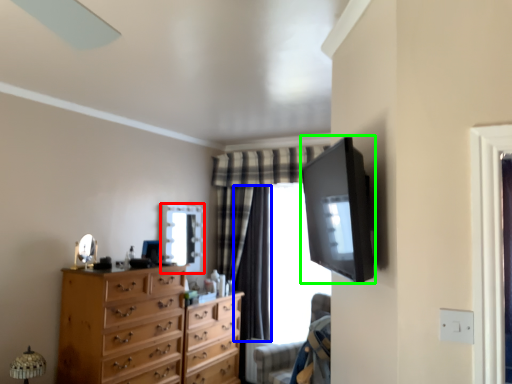
Question: Estimate the real-world distances between objects in this image. Which object is closer to mirror (highlighted by a red box), curtain (highlighted by a blue box) or television (highlighted by a green box)?

Choices:
 (A) curtain
 (B) television

Answer: (A)